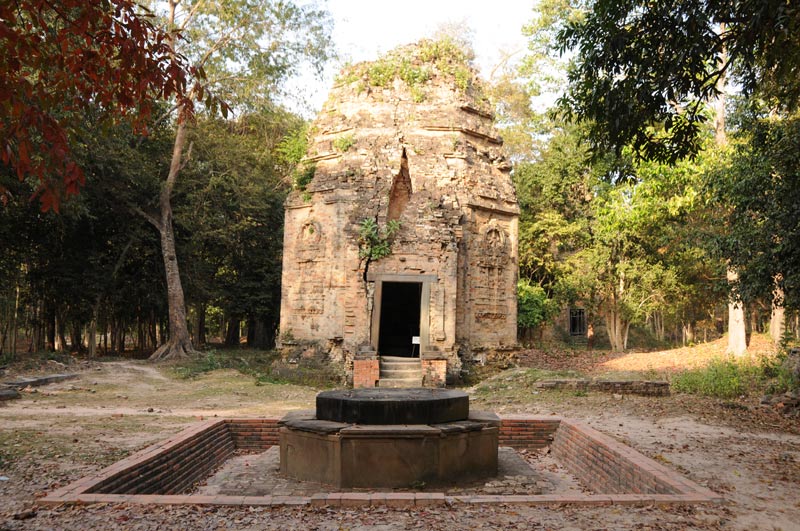
I want to click on window, so pos(574,323).